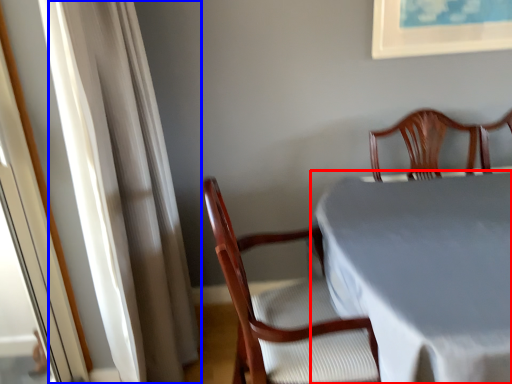
Question: Which object is closer to the camera taking this photo, table (highlighted by a red box) or curtain (highlighted by a blue box)?

Choices:
 (A) table
 (B) curtain

Answer: (A)